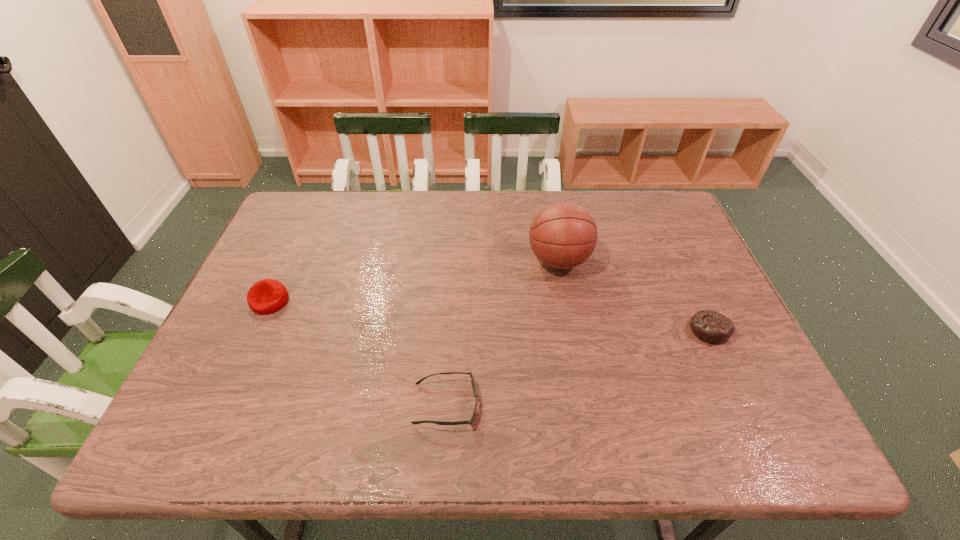
Find the location of `vacant space located 0.060m on the left of the shorter beanbag`. vacant space located 0.060m on the left of the shorter beanbag is located at coordinates (665, 330).

Find the location of a particular element. Image resolution: width=960 pixels, height=540 pixels. vacant space located 0.060m on the front-facing side of the third object from right to left is located at coordinates (505, 404).

Image resolution: width=960 pixels, height=540 pixels. Find the location of `object situated at the near edge`. object situated at the near edge is located at coordinates (473, 383).

In order to click on object that is at the left edge in this screenshot , I will do `click(266, 296)`.

In order to click on object at the right edge in this screenshot , I will do `click(711, 327)`.

The image size is (960, 540). What are the coordinates of `vacant position at the far edge of the desktop` in the screenshot? It's located at (438, 191).

In the image, there is a desktop. Identify the location of vacant space at the near edge. This screenshot has height=540, width=960. (381, 421).

This screenshot has width=960, height=540. I want to click on free spot at the left edge of the desktop, so 245,359.

The height and width of the screenshot is (540, 960). Find the location of `vacant space at the right edge of the desktop`. vacant space at the right edge of the desktop is located at coordinates (730, 344).

In the image, there is a desktop. Identify the location of free space at the far left corner. This screenshot has height=540, width=960. (335, 197).